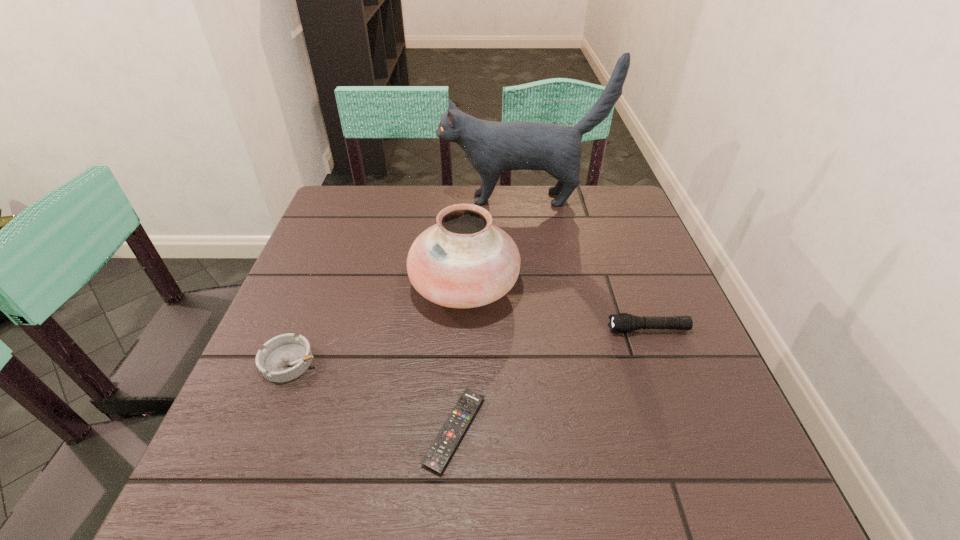
Locate an element on the screen. cat present at the right edge is located at coordinates (492, 147).

Locate an element on the screen. This screenshot has width=960, height=540. flashlight positioned at the right edge is located at coordinates (623, 322).

The image size is (960, 540). Identify the location of object present at the far right corner. [492, 147].

You are a GUI agent. You are given a task and a screenshot of the screen. Output one action in this format:
    pyautogui.click(x=<x>, y=<y>)
    Task: Click on the vacant space at the far edge of the desktop
    
    Given the screenshot: What is the action you would take?
    pyautogui.click(x=505, y=194)

Where is `vacant space at the near edge of the desktop`? This screenshot has width=960, height=540. vacant space at the near edge of the desktop is located at coordinates (501, 514).

In the image, there is a desktop. Find the location of `free space at the left edge`. free space at the left edge is located at coordinates (298, 300).

Find the location of a particular element. This screenshot has height=540, width=960. free space at the right edge of the desktop is located at coordinates (666, 426).

Locate an element on the screen. blank space at the far left corner of the desktop is located at coordinates (372, 213).

In the image, there is a desktop. What are the coordinates of `vacant space at the near left corner` in the screenshot? It's located at (219, 490).

Find the location of a particular element. vacant space at the far right corner is located at coordinates (605, 210).